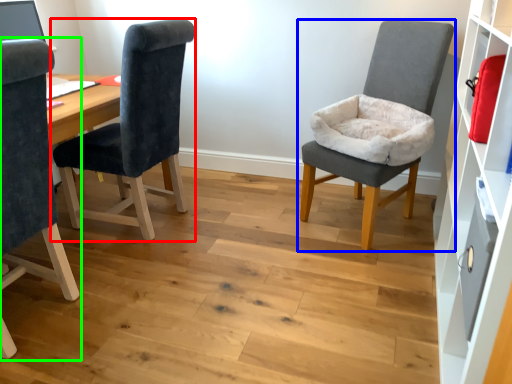
Question: Based on their relative distances, which object is nearer to chair (highlighted by a red box)? Choose from chair (highlighted by a blue box) and chair (highlighted by a green box).

Choices:
 (A) chair
 (B) chair

Answer: (B)